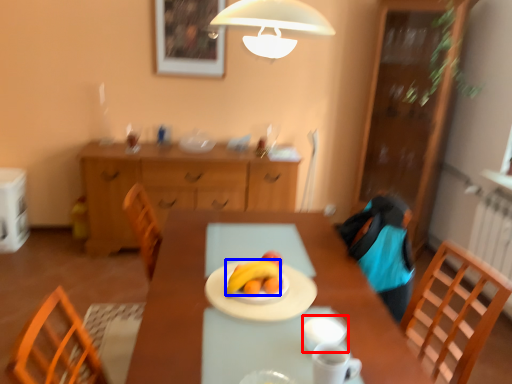
Question: Which of the following is the closest to the observer, tableware (highlighted by a red box) or banana (highlighted by a blue box)?

Choices:
 (A) tableware
 (B) banana

Answer: (A)